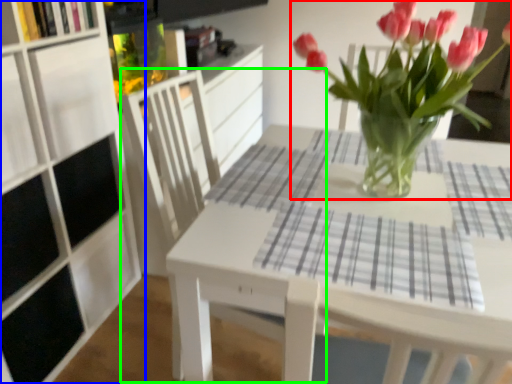
Question: Which object is positioned closest to houseplant (highlighted by a red box)? Select from cabinetry (highlighted by a blue box) and armchair (highlighted by a green box).

Choices:
 (A) cabinetry
 (B) armchair

Answer: (B)